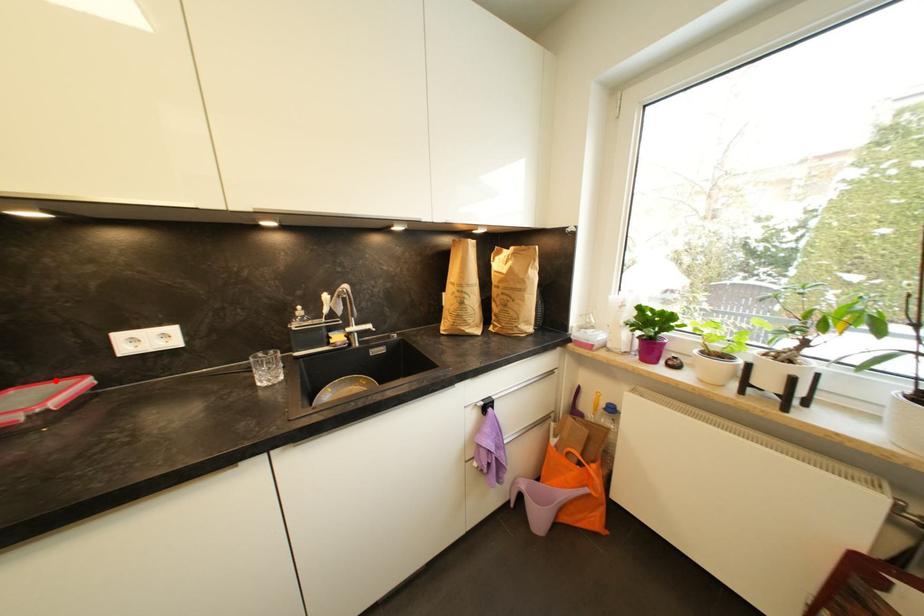
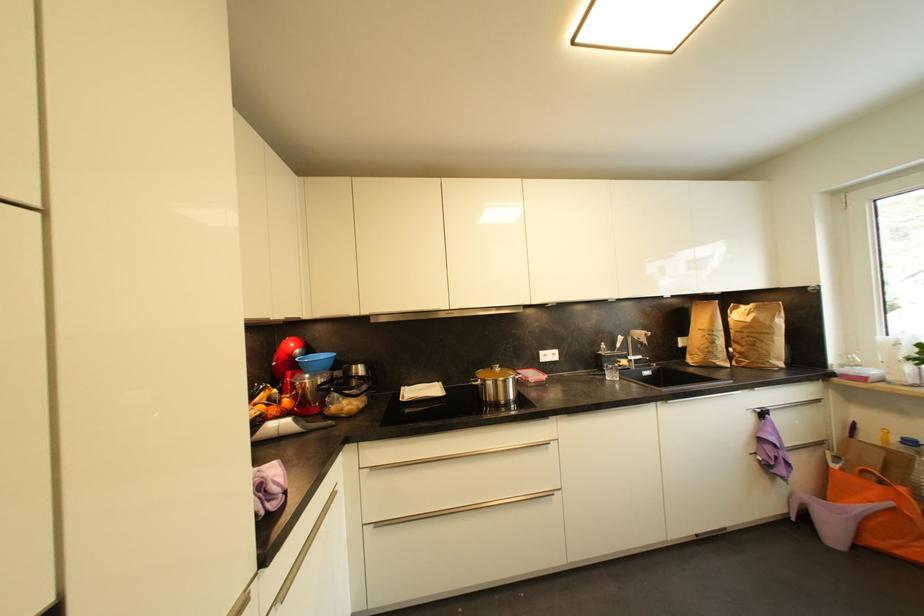
Question: A red point is marked in image1. In image2, is the corresponding 3D point closer to the camera or farther? Reply with the corresponding letter.

Choices:
 (A) The corresponding 3D point is closer.
 (B) The corresponding 3D point is farther.

Answer: (B)